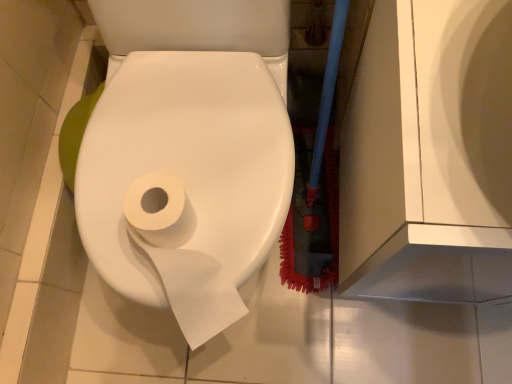
Question: Is white matte toilet paper at center, acting as the first toilet paper starting from the back, oriented away from white matte toilet paper at center, which appears as the first toilet paper when viewed from the front?

Choices:
 (A) no
 (B) yes

Answer: (B)

Question: Does white matte toilet paper at center, acting as the second toilet paper starting from the front, have a greater width compared to white matte toilet paper at center, which is the second toilet paper from back to front?

Choices:
 (A) yes
 (B) no

Answer: (B)

Question: From a real-world perspective, is white matte toilet paper at center, acting as the second toilet paper starting from the front, located beneath white matte toilet paper at center, which is the second toilet paper from back to front?

Choices:
 (A) no
 (B) yes

Answer: (A)

Question: Can you confirm if white matte toilet paper at center, acting as the second toilet paper starting from the front, is bigger than white matte toilet paper at center, which is the second toilet paper from back to front?

Choices:
 (A) no
 (B) yes

Answer: (A)

Question: From the image's perspective, does white matte toilet paper at center, acting as the first toilet paper starting from the back, appear lower than white matte toilet paper at center, which appears as the first toilet paper when viewed from the front?

Choices:
 (A) yes
 (B) no

Answer: (A)

Question: Does white matte toilet paper at center, acting as the second toilet paper starting from the front, appear on the right side of white matte toilet paper at center, which appears as the first toilet paper when viewed from the front?

Choices:
 (A) yes
 (B) no

Answer: (B)

Question: Can you confirm if white matte toilet paper at center, which appears as the first toilet paper when viewed from the front, is bigger than white matte toilet paper at center, acting as the second toilet paper starting from the front?

Choices:
 (A) yes
 (B) no

Answer: (A)

Question: Considering the relative positions of white matte toilet paper at center, which appears as the first toilet paper when viewed from the front, and white matte toilet paper at center, acting as the first toilet paper starting from the back, in the image provided, is white matte toilet paper at center, which appears as the first toilet paper when viewed from the front, to the left of white matte toilet paper at center, acting as the first toilet paper starting from the back, from the viewer's perspective?

Choices:
 (A) no
 (B) yes

Answer: (A)

Question: From a real-world perspective, is white matte toilet paper at center, which is the second toilet paper from back to front, positioned under white matte toilet paper at center, acting as the first toilet paper starting from the back, based on gravity?

Choices:
 (A) yes
 (B) no

Answer: (A)

Question: Can you confirm if white matte toilet paper at center, which appears as the first toilet paper when viewed from the front, is taller than white matte toilet paper at center, acting as the first toilet paper starting from the back?

Choices:
 (A) yes
 (B) no

Answer: (A)

Question: Could you tell me if white matte toilet paper at center, which is the second toilet paper from back to front, is turned towards white matte toilet paper at center, acting as the second toilet paper starting from the front?

Choices:
 (A) no
 (B) yes

Answer: (B)

Question: From the image's perspective, would you say white matte toilet paper at center, which is the second toilet paper from back to front, is shown under white matte toilet paper at center, acting as the second toilet paper starting from the front?

Choices:
 (A) no
 (B) yes

Answer: (A)

Question: Is point (209, 296) closer or farther from the camera than point (228, 226)?

Choices:
 (A) farther
 (B) closer

Answer: (B)